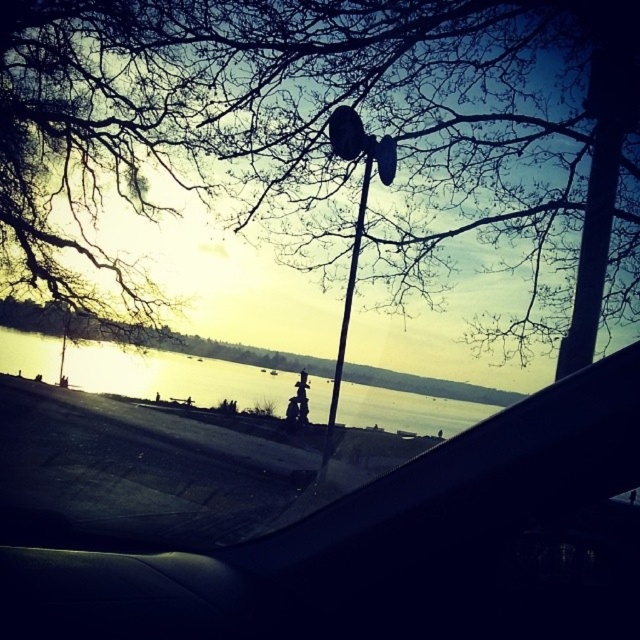
Question: Is bare branches at upper center positioned in front of black metal pole at upper right?

Choices:
 (A) yes
 (B) no

Answer: (B)

Question: Which of the following is the farthest from the observer?

Choices:
 (A) matte black lamp post at center
 (B) black metal pole at upper right

Answer: (A)

Question: Which object is closer to the camera taking this photo?

Choices:
 (A) matte black lamp post at center
 (B) black metal pole at upper right

Answer: (B)

Question: Can you confirm if black metal pole at upper right is bigger than matte black lamp post at center?

Choices:
 (A) no
 (B) yes

Answer: (B)

Question: Estimate the real-world distances between objects in this image. Which object is farther from the silvery reflective water at center?

Choices:
 (A) matte black lamp post at center
 (B) black metal pole at upper right

Answer: (B)

Question: Can you confirm if bare branches at upper center is positioned above matte black lamp post at center?

Choices:
 (A) no
 (B) yes

Answer: (B)